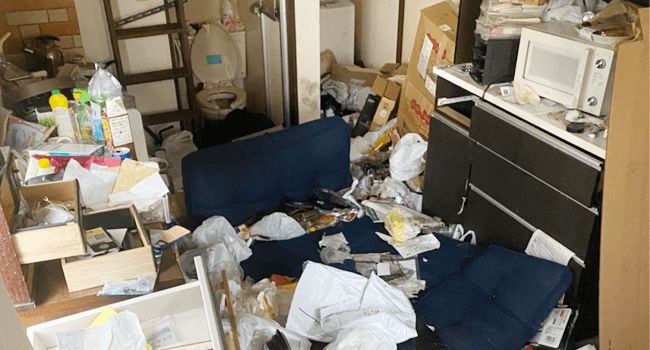
Find the location of a particular element. The width and height of the screenshot is (650, 350). where'd you sit on a toilet is located at coordinates (233, 112), (227, 102).